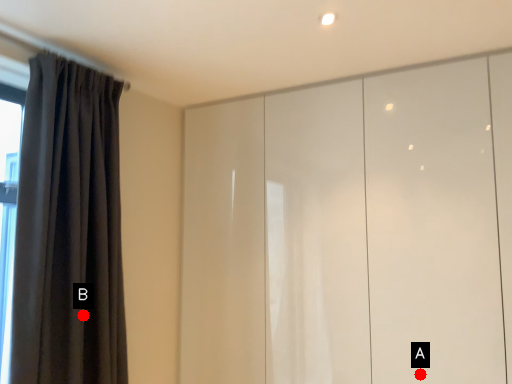
Question: Two points are circled on the image, labeled by A and B beside each circle. Which of the following is the closest to the observer?

Choices:
 (A) A is closer
 (B) B is closer

Answer: (B)